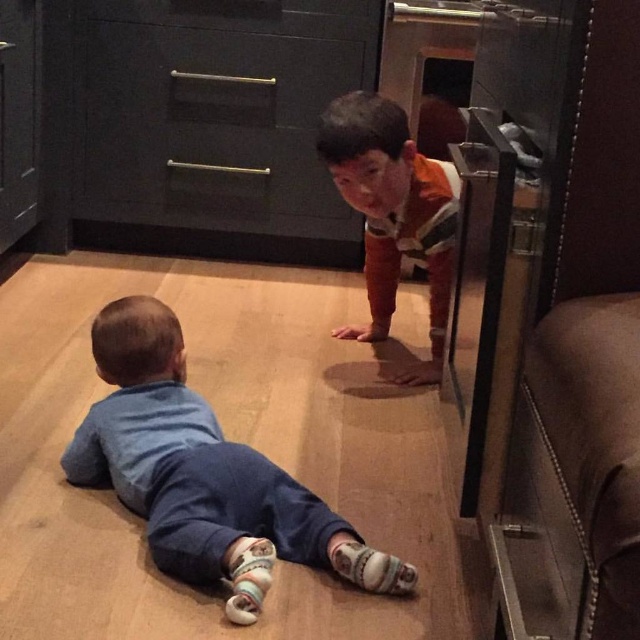
You are a parent trying to reach the matte black drawer at upper center to get a snack for the children. The orange striped shirt at center is in your way. Based on their heights, can you easily reach the drawer without moving the shirt?

The matte black drawer at upper center is taller than the orange striped shirt at center, so you can likely reach it without needing to move the shirt since the drawer is higher up.